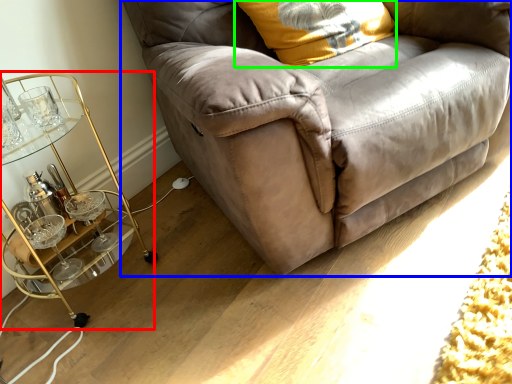
Question: Estimate the real-world distances between objects in this image. Which object is farther from table (highlighted by a red box), studio couch (highlighted by a blue box) or pillow (highlighted by a green box)?

Choices:
 (A) studio couch
 (B) pillow

Answer: (B)